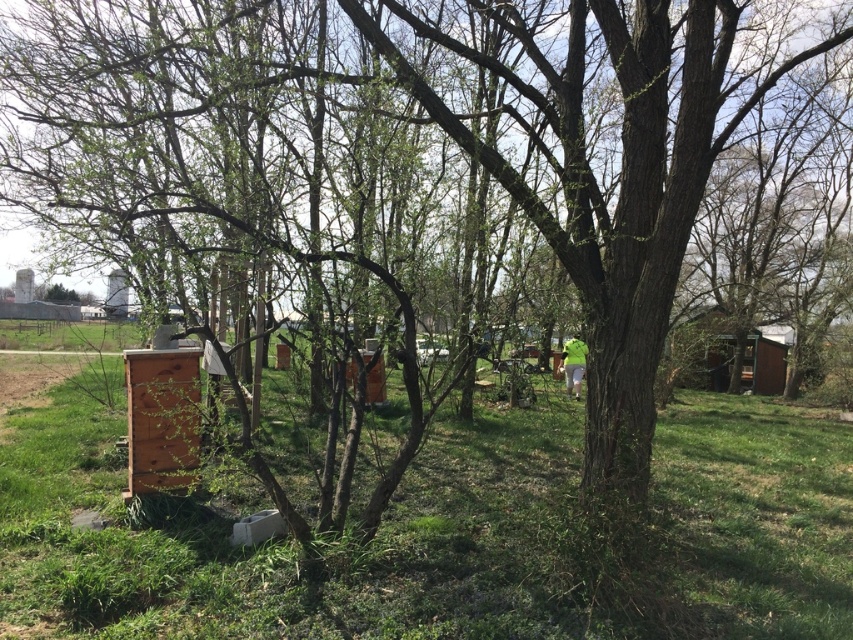
Question: Is green grass at lower left above wooden hut at right?

Choices:
 (A) no
 (B) yes

Answer: (A)

Question: Which of the following is the farthest from the observer?

Choices:
 (A) (93, 540)
 (B) (712, 358)

Answer: (B)

Question: Among these objects, which one is farthest from the camera?

Choices:
 (A) wooden hut at right
 (B) green grass at lower left

Answer: (A)

Question: Can you confirm if green grass at lower left is thinner than wooden hut at right?

Choices:
 (A) no
 (B) yes

Answer: (A)

Question: Which point appears closest to the camera in this image?

Choices:
 (A) (773, 392)
 (B) (383, 422)

Answer: (B)

Question: Is green grass at lower left further to camera compared to wooden hut at right?

Choices:
 (A) no
 (B) yes

Answer: (A)